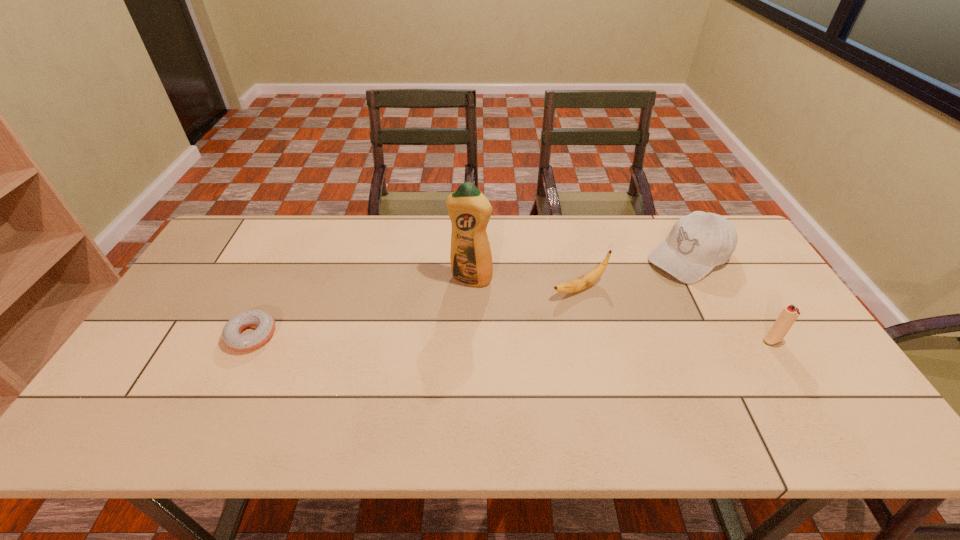
Identify the location of igniter that is positioned at the right edge. pyautogui.click(x=790, y=313).

Image resolution: width=960 pixels, height=540 pixels. What are the coordinates of `baseball cap located in the right edge section of the desktop` in the screenshot? It's located at [698, 242].

The width and height of the screenshot is (960, 540). I want to click on object at the far right corner, so click(x=698, y=242).

Image resolution: width=960 pixels, height=540 pixels. What are the coordinates of `free space at the far edge of the desktop` in the screenshot? It's located at (493, 250).

In the image, there is a desktop. Identify the location of vacant region at the near edge. The width and height of the screenshot is (960, 540). (203, 395).

In order to click on free space at the left edge of the desktop in this screenshot , I will do `click(201, 309)`.

Where is `free space at the right edge`? The image size is (960, 540). free space at the right edge is located at coordinates [x=764, y=327].

In the image, there is a desktop. Where is `vacant region at the far left corner`? This screenshot has width=960, height=540. vacant region at the far left corner is located at coordinates (236, 245).

The height and width of the screenshot is (540, 960). In the image, there is a desktop. Find the location of `vacant space at the near right corner`. vacant space at the near right corner is located at coordinates pyautogui.click(x=791, y=393).

This screenshot has width=960, height=540. Find the location of `unoccupied area between the igniter and the doughnut`. unoccupied area between the igniter and the doughnut is located at coordinates (512, 338).